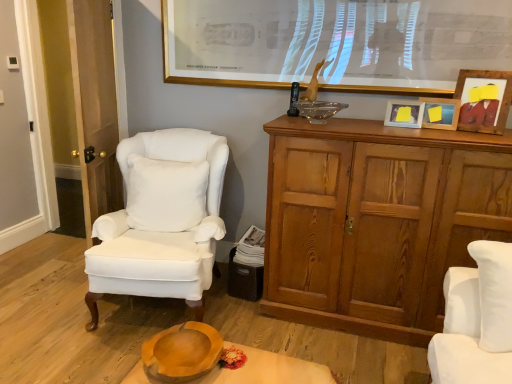
Image resolution: width=512 pixels, height=384 pixels. In order to click on transparent glass door at left in this screenshot , I will do `click(95, 107)`.

I want to click on black plastic remote control at upper center, so click(x=294, y=100).

This screenshot has height=384, width=512. Find the location of `wooden bowl at lower center`. wooden bowl at lower center is located at coordinates pyautogui.click(x=182, y=352).

The height and width of the screenshot is (384, 512). Describe the element at coordinates (476, 319) in the screenshot. I see `white fabric chair at right, which is the second chair in back-to-front order` at that location.

Where is `transparent glass bowl at upper center`? transparent glass bowl at upper center is located at coordinates (319, 110).

What is the approximate width of transparent glass bowl at upper center?

The width of transparent glass bowl at upper center is 24.52 centimeters.

Where is `white velvet pillow at center`? The height and width of the screenshot is (384, 512). white velvet pillow at center is located at coordinates pyautogui.click(x=165, y=194).

At what (x,y) coordinates should I click in order to perform the action: click on transparent glass door at left. Please return your answer as a coordinate pair (x, y). Looking at the image, I should click on (95, 107).

Image resolution: width=512 pixels, height=384 pixels. Identify the location of pillow below the white matte picture frame at upper right, positioned as the 3th picture frame in right-to-left order (from the image's perspective). (165, 194).

What's the angular difference between white velvet pillow at center and white matte picture frame at upper right, positioned as the 3th picture frame in right-to-left order,'s facing directions?

22 degrees.

Considering the positions of points (167, 218) and (399, 111), is point (167, 218) farther from camera compared to point (399, 111)?

Yes, it is behind point (399, 111).

Is white velvet pillow at center spatially inside white matte picture frame at upper right, positioned as the 3th picture frame in right-to-left order, or outside of it?

white velvet pillow at center is not inside white matte picture frame at upper right, positioned as the 3th picture frame in right-to-left order, it's outside.

Considering the points (428, 125) and (297, 90), which point is in front, point (428, 125) or point (297, 90)?

The point (428, 125) is closer.

Considering the sizes of objects yellow paper picture frame at upper center, placed as the third picture frame when sorted from left to right, and black plastic remote control at upper center in the image provided, who is shorter, yellow paper picture frame at upper center, placed as the third picture frame when sorted from left to right, or black plastic remote control at upper center?

With less height is yellow paper picture frame at upper center, placed as the third picture frame when sorted from left to right.

Which of these two, yellow paper picture frame at upper center, which is counted as the 2th picture frame, starting from the right, or black plastic remote control at upper center, is bigger?

Bigger between the two is yellow paper picture frame at upper center, which is counted as the 2th picture frame, starting from the right.

From a real-world perspective, between yellow paper picture frame at upper center, placed as the third picture frame when sorted from left to right, and black plastic remote control at upper center, who is vertically lower?

In real-world perspective, yellow paper picture frame at upper center, placed as the third picture frame when sorted from left to right, is lower.

Is wooden cabinet at right situated inside gold-framed picture at upper center, placed as the 1th picture frame when sorted from left to right, or outside?

wooden cabinet at right exists outside the volume of gold-framed picture at upper center, placed as the 1th picture frame when sorted from left to right.

How distant is wooden cabinet at right from gold-framed picture at upper center, which appears as the fourth picture frame when viewed from the right?

The distance of wooden cabinet at right from gold-framed picture at upper center, which appears as the fourth picture frame when viewed from the right, is 32.44 inches.

From the image's perspective, would you say wooden cabinet at right is positioned over gold-framed picture at upper center, which appears as the fourth picture frame when viewed from the right?

No, from the image's perspective, wooden cabinet at right is not over gold-framed picture at upper center, which appears as the fourth picture frame when viewed from the right.

Is wooden cabinet at right at the left side of gold-framed picture at upper center, which appears as the fourth picture frame when viewed from the right?

In fact, wooden cabinet at right is to the right of gold-framed picture at upper center, which appears as the fourth picture frame when viewed from the right.

From the image's perspective, is white matte picture frame at upper right, which is the 2th picture frame in left-to-right order, located above transparent glass bowl at upper center?

Actually, white matte picture frame at upper right, which is the 2th picture frame in left-to-right order, appears below transparent glass bowl at upper center in the image.

Find the location of a particular element. The height and width of the screenshot is (384, 512). glass bowl that is above the white matte picture frame at upper right, which is the 2th picture frame in left-to-right order (from the image's perspective) is located at coordinates (319, 110).

Looking at their sizes, would you say white matte picture frame at upper right, positioned as the 3th picture frame in right-to-left order, is wider or thinner than transparent glass bowl at upper center?

white matte picture frame at upper right, positioned as the 3th picture frame in right-to-left order, is thinner than transparent glass bowl at upper center.

What's the angular difference between white velvet pillow at center and transparent glass door at left's facing directions?

white velvet pillow at center and transparent glass door at left are facing 81.7 degrees away from each other.

From the image's perspective, which one is positioned higher, white velvet pillow at center or transparent glass door at left?

From the image's view, transparent glass door at left is above.

Is point (137, 205) farther from viewer compared to point (82, 80)?

Yes, it is behind point (82, 80).

From a real-world perspective, which object stands above the other?

transparent glass door at left, from a real-world perspective.

Can we say black plastic remote control at upper center lies outside wooden cabinet at right?

black plastic remote control at upper center is positioned outside wooden cabinet at right.

Which is in front, point (293, 97) or point (388, 271)?

Positioned in front is point (388, 271).

From the picture: From the image's perspective, which is below, black plastic remote control at upper center or wooden cabinet at right?

wooden cabinet at right.

Does black plastic remote control at upper center have a smaller size compared to wooden cabinet at right?

Yes, black plastic remote control at upper center is smaller than wooden cabinet at right.

From the image's perspective, is white fabric chair at left, which is the first chair from back to front, over yellow paper picture frame at upper center, placed as the third picture frame when sorted from left to right?

Actually, white fabric chair at left, which is the first chair from back to front, appears below yellow paper picture frame at upper center, placed as the third picture frame when sorted from left to right, in the image.

In terms of width, does white fabric chair at left, the first chair from the left, look wider or thinner when compared to yellow paper picture frame at upper center, placed as the third picture frame when sorted from left to right?

Clearly, white fabric chair at left, the first chair from the left, has more width compared to yellow paper picture frame at upper center, placed as the third picture frame when sorted from left to right.

Is white fabric chair at left, which appears as the second chair when viewed from the front, oriented towards yellow paper picture frame at upper center, which is counted as the 2th picture frame, starting from the right?

No.

Considering the relative positions of white fabric chair at left, the first chair from the left, and yellow paper picture frame at upper center, placed as the third picture frame when sorted from left to right, in the image provided, is white fabric chair at left, the first chair from the left, behind yellow paper picture frame at upper center, placed as the third picture frame when sorted from left to right,?

No.

From the image's perspective, which picture frame is the 1st one above the white velvet pillow at center? Please provide its 2D coordinates.

[(404, 114)]

This screenshot has height=384, width=512. What are the coordinates of `remote control on the left of yellow paper picture frame at upper center, which is counted as the 2th picture frame, starting from the right` in the screenshot? It's located at (294, 100).

Estimate the real-world distances between objects in this image. Which object is further from black plastic remote control at upper center, transparent glass bowl at upper center or gold-framed picture at upper center, placed as the 1th picture frame when sorted from left to right?

gold-framed picture at upper center, placed as the 1th picture frame when sorted from left to right.

From the image, which object appears to be farther from white fabric chair at right, the first chair when ordered from front to back, gold-framed picture at upper center, placed as the 1th picture frame when sorted from left to right, or transparent glass door at left?

The object further to white fabric chair at right, the first chair when ordered from front to back, is transparent glass door at left.

From the image, which object appears to be nearer to wooden bowl at lower center, yellow paper picture frame at upper center, placed as the third picture frame when sorted from left to right, or transparent glass door at left?

transparent glass door at left lies closer to wooden bowl at lower center than the other object.

Considering their positions, is white matte picture frame at upper right, which is the 2th picture frame in left-to-right order, positioned closer to black plastic remote control at upper center than gold-framed picture at upper center, which appears as the fourth picture frame when viewed from the right?

gold-framed picture at upper center, which appears as the fourth picture frame when viewed from the right, is closer to black plastic remote control at upper center.

When comparing their distances from wooden cabinet at right, does yellow paper picture frame at upper center, placed as the third picture frame when sorted from left to right, or white fabric chair at right, which is the second chair in back-to-front order, seem further?

yellow paper picture frame at upper center, placed as the third picture frame when sorted from left to right, lies further to wooden cabinet at right than the other object.

Estimate the real-world distances between objects in this image. Which object is closer to white velvet pillow at center, white matte picture frame at upper right, which is the 2th picture frame in left-to-right order, or transparent glass door at left?

transparent glass door at left.

Considering their positions, is black plastic remote control at upper center positioned further to gold-framed picture at upper center, which appears as the fourth picture frame when viewed from the right, than transparent glass bowl at upper center?

Based on the image, black plastic remote control at upper center appears to be further to gold-framed picture at upper center, which appears as the fourth picture frame when viewed from the right.

Looking at the image, which one is located closer to gold-framed picture at upper center, placed as the 1th picture frame when sorted from left to right, white fabric chair at right, the first chair when ordered from front to back, or white fabric chair at left, which appears as the second chair when viewed from the front?

white fabric chair at left, which appears as the second chair when viewed from the front, is closer to gold-framed picture at upper center, placed as the 1th picture frame when sorted from left to right.

Where is `cabinetry located between wooden bowl at lower center and black plastic remote control at upper center in the depth direction`? cabinetry located between wooden bowl at lower center and black plastic remote control at upper center in the depth direction is located at coordinates (377, 222).

What are the coordinates of `hat between transparent glass door at left and wooden picture frame at upper right, which is the fourth picture frame from left to right, from left to right` in the screenshot? It's located at (182, 352).

This screenshot has height=384, width=512. Find the location of `remote control between white velvet pillow at center and white fabric chair at right, marked as the first chair in a right-to-left arrangement, from left to right`. remote control between white velvet pillow at center and white fabric chair at right, marked as the first chair in a right-to-left arrangement, from left to right is located at coordinates (294, 100).

Identify the location of remote control between white fabric chair at left, which appears as the second chair when viewed from the front, and white matte picture frame at upper right, positioned as the 3th picture frame in right-to-left order, from left to right. Image resolution: width=512 pixels, height=384 pixels. (294, 100).